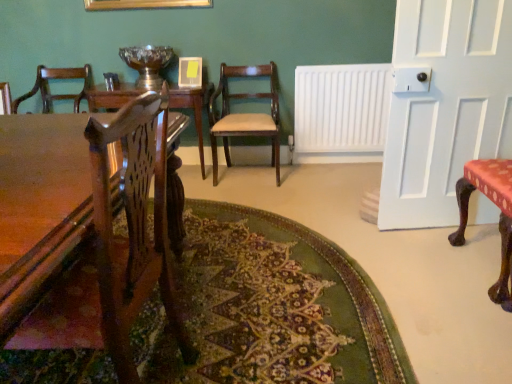
Question: From the image's perspective, is white painted wood door at right below red fabric-covered chair at right, which is the 2th chair in back-to-front order?

Choices:
 (A) no
 (B) yes

Answer: (A)

Question: Considering the relative sizes of white painted wood door at right and red fabric-covered chair at right, which is the 2th chair in back-to-front order, in the image provided, is white painted wood door at right smaller than red fabric-covered chair at right, which is the 2th chair in back-to-front order,?

Choices:
 (A) no
 (B) yes

Answer: (B)

Question: Does white painted wood door at right appear on the right side of red fabric-covered chair at right, the first chair when ordered from right to left?

Choices:
 (A) yes
 (B) no

Answer: (B)

Question: Is there a large distance between white painted wood door at right and red fabric-covered chair at right, which is the 2th chair in back-to-front order?

Choices:
 (A) no
 (B) yes

Answer: (A)

Question: Can you confirm if white painted wood door at right is thinner than red fabric-covered chair at right, the first chair from the front?

Choices:
 (A) yes
 (B) no

Answer: (A)

Question: Considering the positions of red fabric-covered chair at right, the first chair when ordered from right to left, and white painted wood door at right in the image, is red fabric-covered chair at right, the first chair when ordered from right to left, taller or shorter than white painted wood door at right?

Choices:
 (A) tall
 (B) short

Answer: (B)

Question: Relative to white painted wood door at right, is red fabric-covered chair at right, which is the 2th chair in back-to-front order, in front or behind?

Choices:
 (A) behind
 (B) front

Answer: (B)

Question: Does point (506, 168) appear closer or farther from the camera than point (402, 14)?

Choices:
 (A) closer
 (B) farther

Answer: (A)

Question: Considering the relative positions of red fabric-covered chair at right, the first chair when ordered from right to left, and white painted wood door at right in the image provided, is red fabric-covered chair at right, the first chair when ordered from right to left, to the left or to the right of white painted wood door at right?

Choices:
 (A) right
 (B) left

Answer: (A)

Question: From their relative heights in the image, would you say white painted wood door at right is taller or shorter than mahogany wood chair at center, the first chair when ordered from back to front?

Choices:
 (A) short
 (B) tall

Answer: (B)

Question: From a real-world perspective, is white painted wood door at right physically located above or below mahogany wood chair at center, the second chair in the front-to-back sequence?

Choices:
 (A) below
 (B) above

Answer: (B)

Question: In terms of width, does white painted wood door at right look wider or thinner when compared to mahogany wood chair at center, which appears as the 2th chair when viewed from the right?

Choices:
 (A) thin
 (B) wide

Answer: (A)

Question: Is white painted wood door at right spatially inside mahogany wood chair at center, the second chair in the front-to-back sequence, or outside of it?

Choices:
 (A) outside
 (B) inside

Answer: (A)

Question: Do you think wooden table at center is within mahogany wood chair at center, positioned as the first chair in left-to-right order, or outside of it?

Choices:
 (A) inside
 (B) outside

Answer: (B)

Question: Is point (88, 160) closer or farther from the camera than point (228, 71)?

Choices:
 (A) farther
 (B) closer

Answer: (B)